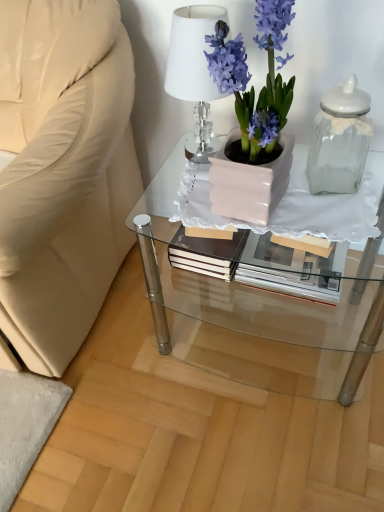
Question: Is matte pink pot at center facing away from clear glass jar at right?

Choices:
 (A) yes
 (B) no

Answer: (B)

Question: Considering the relative sizes of matte pink pot at center and clear glass jar at right in the image provided, is matte pink pot at center smaller than clear glass jar at right?

Choices:
 (A) no
 (B) yes

Answer: (A)

Question: Does matte pink pot at center turn towards clear glass jar at right?

Choices:
 (A) yes
 (B) no

Answer: (B)

Question: Is matte pink pot at center wider than clear glass jar at right?

Choices:
 (A) no
 (B) yes

Answer: (B)

Question: From a real-world perspective, does matte pink pot at center stand above clear glass jar at right?

Choices:
 (A) no
 (B) yes

Answer: (B)

Question: From a real-world perspective, is matte pink pot at center located beneath clear glass jar at right?

Choices:
 (A) yes
 (B) no

Answer: (B)

Question: Considering the relative sizes of clear glass jar at right and matte white glass table at center in the image provided, is clear glass jar at right wider than matte white glass table at center?

Choices:
 (A) no
 (B) yes

Answer: (A)

Question: Considering the relative sizes of clear glass jar at right and matte white glass table at center in the image provided, is clear glass jar at right smaller than matte white glass table at center?

Choices:
 (A) yes
 (B) no

Answer: (A)

Question: Is clear glass jar at right positioned before matte white glass table at center?

Choices:
 (A) yes
 (B) no

Answer: (A)

Question: Is the depth of clear glass jar at right greater than that of matte white glass table at center?

Choices:
 (A) no
 (B) yes

Answer: (A)

Question: Considering the relative positions of clear glass jar at right and matte white glass table at center in the image provided, is clear glass jar at right to the right of matte white glass table at center from the viewer's perspective?

Choices:
 (A) yes
 (B) no

Answer: (A)

Question: Considering the relative sizes of clear glass jar at right and matte white glass table at center in the image provided, is clear glass jar at right bigger than matte white glass table at center?

Choices:
 (A) yes
 (B) no

Answer: (B)

Question: Considering the relative sizes of matte white glass table at center and clear glass jar at right in the image provided, is matte white glass table at center wider than clear glass jar at right?

Choices:
 (A) no
 (B) yes

Answer: (B)